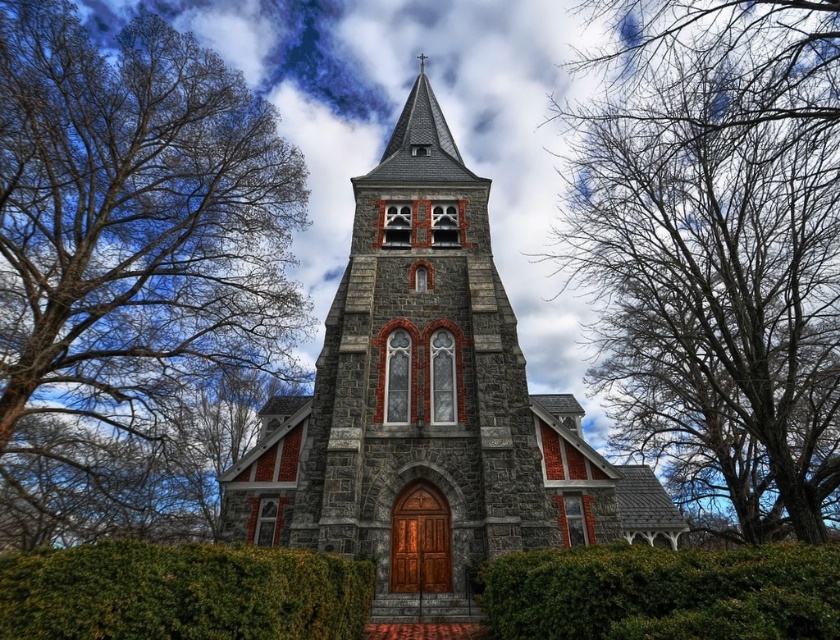
You are standing at the point marked as point (429, 406) in the image. What structure are you facing directly?

The gray stone church at center is located at point (429, 406), so you are facing the gray stone church at center directly.

You are an artist planning to paint the church scene. You notice the bare branches at upper left and the green leafy hedge at center. Which of these two elements would you need to depict with a larger scale in your painting to maintain the scene proportions?

The bare branches at upper left has a larger size compared to the green leafy hedge at center, so you should depict the bare branches at upper left with a larger scale in your painting to maintain the scene proportions.

You are an architect analyzing the church facade. You notice the bare branches at upper left and the green leafy hedge at center. Which of these two elements has a greater height in the composition?

The bare branches at upper left has a greater height compared to the green leafy hedge at center.